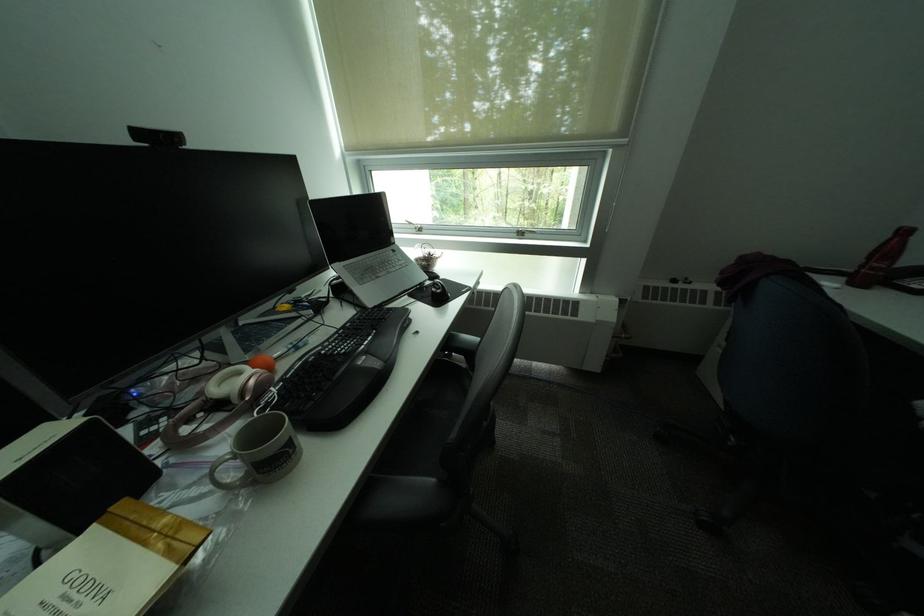
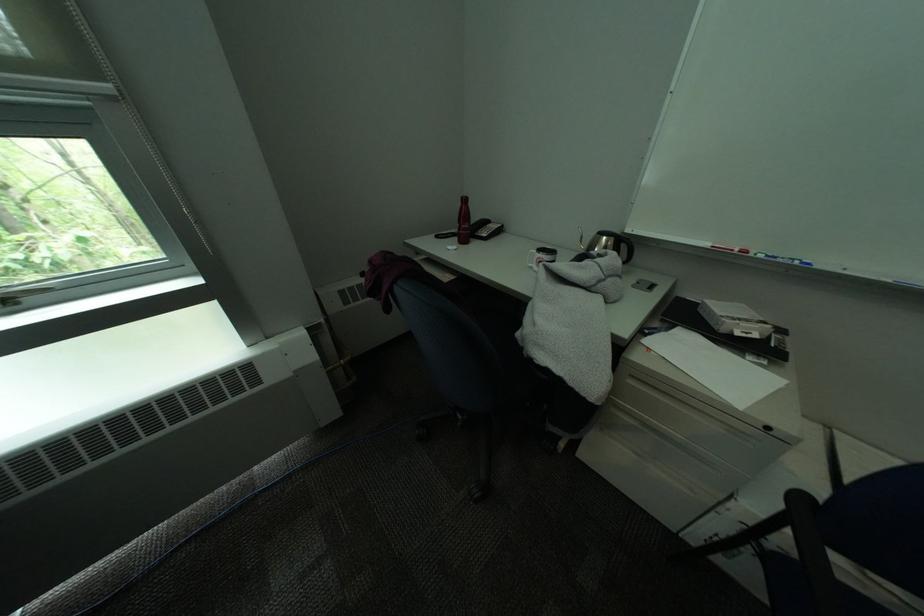
The point at (531, 235) is marked in the first image. Where is the corresponding point in the second image?

(15, 302)